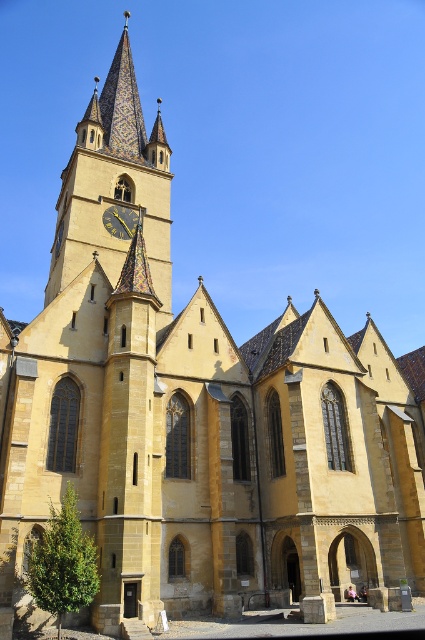
Question: Is golden mosaic spire at upper center below gold textured clock at upper center?

Choices:
 (A) yes
 (B) no

Answer: (B)

Question: Is golden mosaic spire at upper center to the left of gold textured clock at upper center from the viewer's perspective?

Choices:
 (A) no
 (B) yes

Answer: (B)

Question: Does golden mosaic spire at upper center lie behind gold textured clock at upper center?

Choices:
 (A) yes
 (B) no

Answer: (B)

Question: Which of the following is the farthest from the observer?

Choices:
 (A) gold textured clock at upper center
 (B) golden mosaic spire at upper center

Answer: (A)